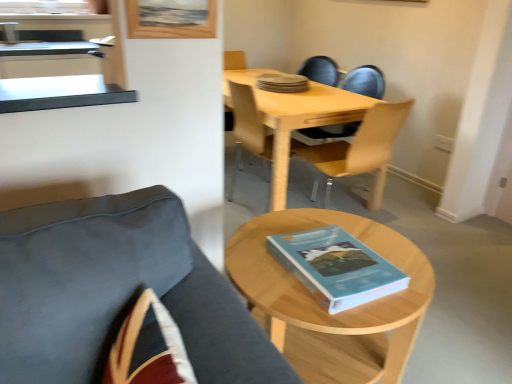
The width and height of the screenshot is (512, 384). I want to click on free space above light wood/woodenobject at lower right (from a real-world perspective), so (329, 241).